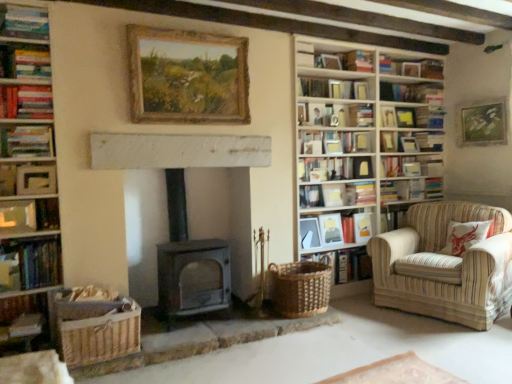
The image size is (512, 384). In order to click on blank space situated above hardcover book at left, which is the eighth book from bottom to top (from a real-world perspective) in this screenshot , I will do `click(28, 125)`.